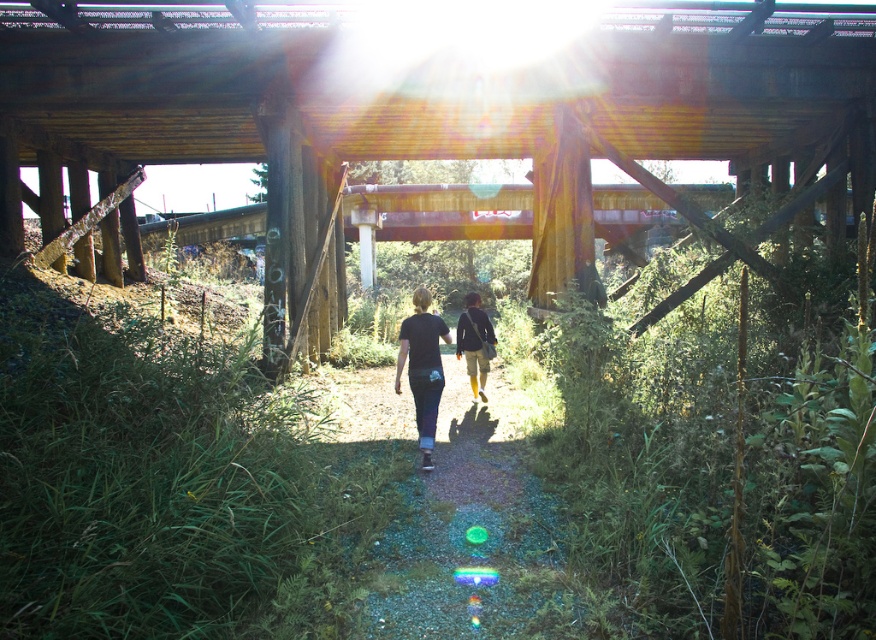
You are standing at the entrance of the bridge and want to find the dirt path at center. According to the coordinates provided, where should you look to locate it?

The dirt path at center is located at coordinates point (451, 515).

You are standing under the bridge and want to walk along the path. Can you step onto the dirt path at center without your yellow fabric pants at center getting dirty?

The dirt path at center is not as tall as yellow fabric pants at center, so the dirt path is lower than the pants. Therefore, stepping onto the dirt path at center might not get the yellow fabric pants at center dirty since the path is lower and less likely to splash or come into contact with the pants.